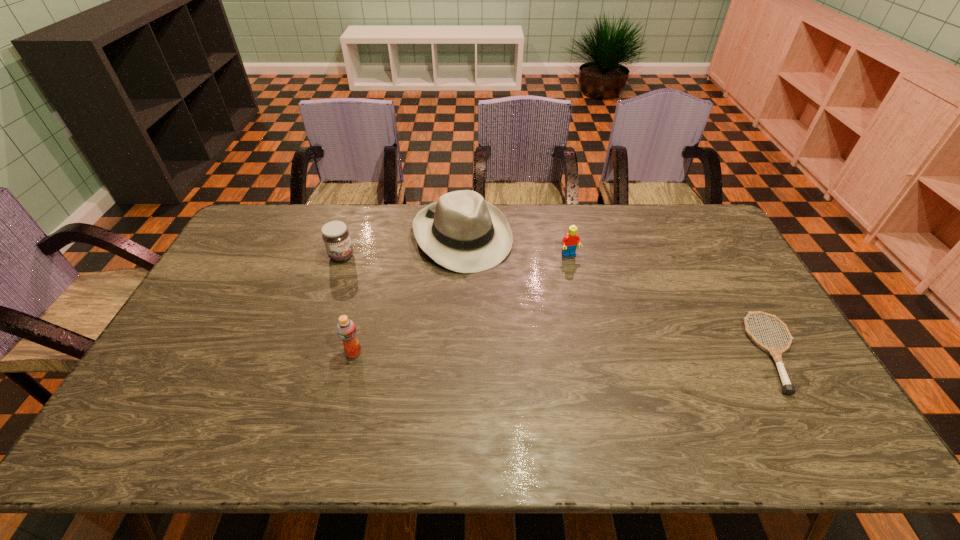
I want to click on object situated at the near right corner, so click(776, 353).

This screenshot has width=960, height=540. Find the location of `free space at the far edge of the desktop`. free space at the far edge of the desktop is located at coordinates (564, 209).

Identify the location of vacant space at the near edge. This screenshot has height=540, width=960. (285, 406).

Find the location of a particular element. The width and height of the screenshot is (960, 540). free point at the left edge is located at coordinates (260, 260).

Image resolution: width=960 pixels, height=540 pixels. In the image, there is a desktop. Find the location of `vacant space at the right edge`. vacant space at the right edge is located at coordinates (717, 292).

Image resolution: width=960 pixels, height=540 pixels. In the image, there is a desktop. In order to click on blank space at the far left corner in this screenshot , I will do `click(266, 244)`.

The height and width of the screenshot is (540, 960). Identify the location of free space at the far right corner of the desktop. (691, 214).

Where is `free location at the near right corner of the desktop`? This screenshot has width=960, height=540. free location at the near right corner of the desktop is located at coordinates (761, 381).

You are a GUI agent. You are given a task and a screenshot of the screen. Output one action in this format:
    pyautogui.click(x=<x>, y=<y>)
    Task: Click on the free area in between the leftmost object and the fedora
    
    Given the screenshot: What is the action you would take?
    pyautogui.click(x=402, y=246)

The image size is (960, 540). In order to click on free space between the third object from right to left and the orange juice in this screenshot , I will do `click(408, 294)`.